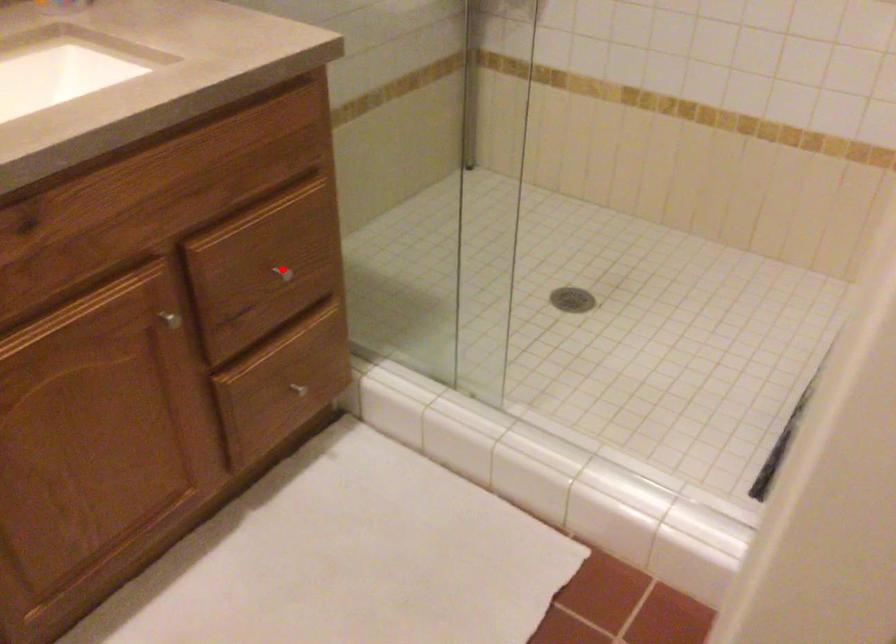
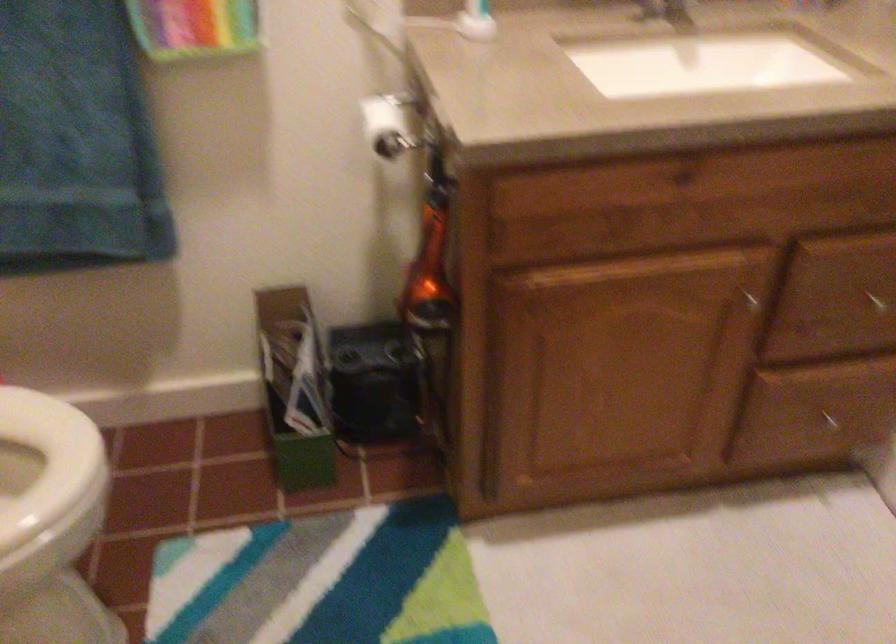
The point at the highlighted location is marked in the first image. Where is the corresponding point in the second image?

(875, 301)